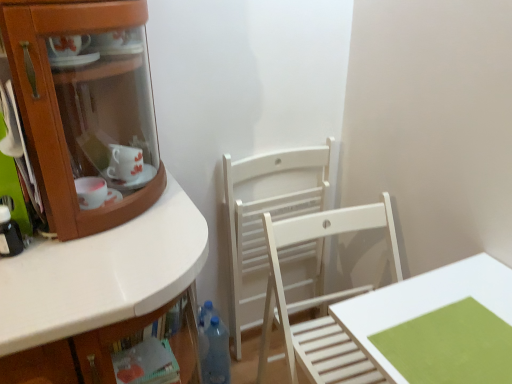
Question: Should I look upward or downward to see white matte table at lower right?

Choices:
 (A) up
 (B) down

Answer: (B)

Question: From a real-world perspective, is transparent plastic bottle at lower center, which appears as the 1th bottle when viewed from the right, under translucent plastic bottle at left, which ranks as the first bottle in front-to-back order?

Choices:
 (A) no
 (B) yes

Answer: (B)

Question: Considering the relative sizes of transparent plastic bottle at lower center, positioned as the first bottle in back-to-front order, and translucent plastic bottle at left, the 2th bottle in the right-to-left sequence, in the image provided, is transparent plastic bottle at lower center, positioned as the first bottle in back-to-front order, wider than translucent plastic bottle at left, the 2th bottle in the right-to-left sequence,?

Choices:
 (A) yes
 (B) no

Answer: (A)

Question: Considering the relative sizes of transparent plastic bottle at lower center, positioned as the first bottle in back-to-front order, and translucent plastic bottle at left, the 2th bottle in the right-to-left sequence, in the image provided, is transparent plastic bottle at lower center, positioned as the first bottle in back-to-front order, smaller than translucent plastic bottle at left, the 2th bottle in the right-to-left sequence,?

Choices:
 (A) yes
 (B) no

Answer: (B)

Question: Is transparent plastic bottle at lower center, which ranks as the 2th bottle in front-to-back order, bigger than translucent plastic bottle at left, the 2th bottle in the right-to-left sequence?

Choices:
 (A) no
 (B) yes

Answer: (B)

Question: Does transparent plastic bottle at lower center, positioned as the first bottle in back-to-front order, appear on the right side of translucent plastic bottle at left, the 2th bottle in the bottom-to-top sequence?

Choices:
 (A) no
 (B) yes

Answer: (B)

Question: Is transparent plastic bottle at lower center, the 2th bottle when ordered from top to bottom, shorter than translucent plastic bottle at left, which ranks as the first bottle in front-to-back order?

Choices:
 (A) no
 (B) yes

Answer: (A)

Question: From the image's perspective, is transparent plastic bottle at lower center, positioned as the first bottle in back-to-front order, located above white matte table at lower right?

Choices:
 (A) no
 (B) yes

Answer: (A)

Question: Considering the relative sizes of transparent plastic bottle at lower center, which is counted as the second bottle, starting from the left, and white matte table at lower right in the image provided, is transparent plastic bottle at lower center, which is counted as the second bottle, starting from the left, thinner than white matte table at lower right?

Choices:
 (A) no
 (B) yes

Answer: (B)

Question: From a real-world perspective, is transparent plastic bottle at lower center, which is counted as the second bottle, starting from the left, on top of white matte table at lower right?

Choices:
 (A) no
 (B) yes

Answer: (A)

Question: Can you confirm if transparent plastic bottle at lower center, which appears as the 1th bottle when viewed from the right, is shorter than white matte table at lower right?

Choices:
 (A) yes
 (B) no

Answer: (B)

Question: Can you confirm if transparent plastic bottle at lower center, which appears as the 1th bottle when viewed from the right, is bigger than white matte table at lower right?

Choices:
 (A) no
 (B) yes

Answer: (A)

Question: Could you tell me if transparent plastic bottle at lower center, which is counted as the first bottle, starting from the bottom, is turned towards white matte table at lower right?

Choices:
 (A) yes
 (B) no

Answer: (B)

Question: Does translucent plastic bottle at left, the 2th bottle in the right-to-left sequence, contain white matte table at lower right?

Choices:
 (A) yes
 (B) no

Answer: (B)